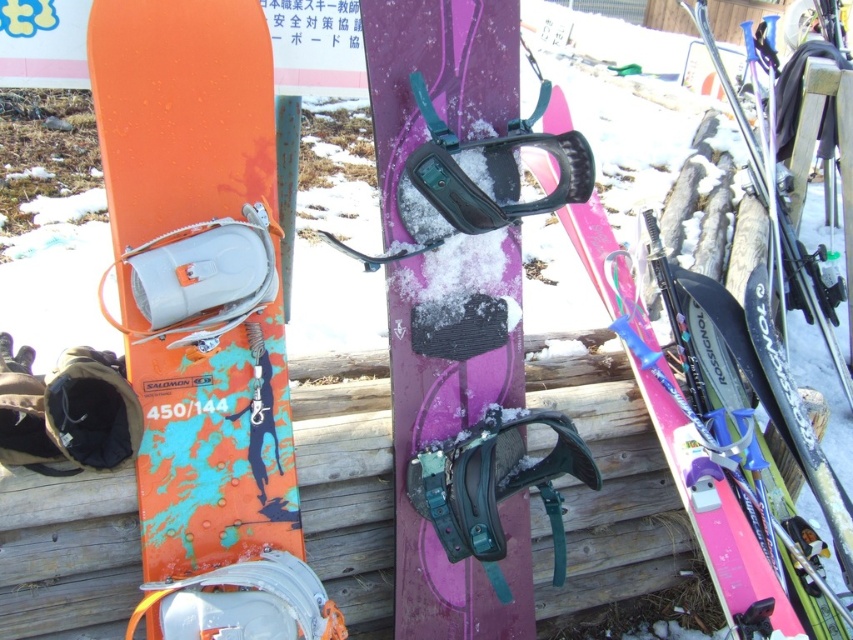
Question: Does purple matte snowboard at center have a larger size compared to pink matte snowboard at center?

Choices:
 (A) no
 (B) yes

Answer: (A)

Question: Which point is closer to the camera?

Choices:
 (A) green matte goggles at center
 (B) purple matte snowboard at center
 (C) pink matte snowboard at center
 (D) orange matte/splatter snowboard at left

Answer: (D)

Question: In this image, where is green matte goggles at center located relative to black matte goggles at center?

Choices:
 (A) above
 (B) below

Answer: (B)

Question: Where is orange matte/splatter snowboard at left located in relation to pink matte snowboard at center in the image?

Choices:
 (A) right
 (B) left

Answer: (B)

Question: Estimate the real-world distances between objects in this image. Which object is farther from the black matte goggles at center?

Choices:
 (A) orange matte/splatter snowboard at left
 (B) green matte goggles at center

Answer: (A)

Question: Considering the real-world distances, which object is closest to the purple matte snowboard at center?

Choices:
 (A) orange matte/splatter snowboard at left
 (B) pink matte snowboard at center
 (C) black matte goggles at center
 (D) green matte goggles at center

Answer: (D)